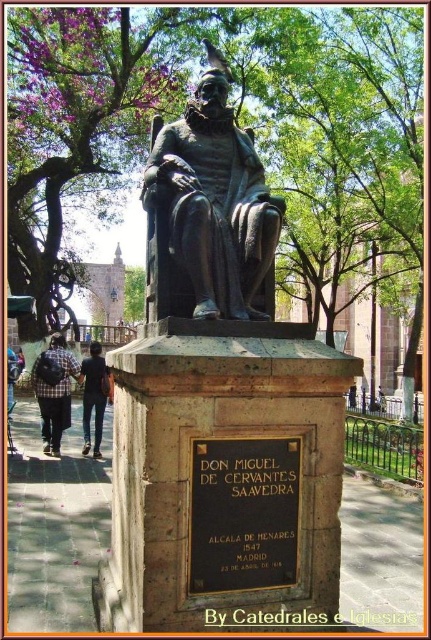
Question: Is black polished stone plaque at center below dark blue jeans at lower left?

Choices:
 (A) no
 (B) yes

Answer: (A)

Question: Can you confirm if black polished stone plaque at center is positioned to the right of dark blue jeans at lower left?

Choices:
 (A) yes
 (B) no

Answer: (A)

Question: Which of the following is the closest to the observer?

Choices:
 (A) plaid fabric backpack at lower left
 (B) dark blue jeans at lower left

Answer: (A)

Question: Which point is farther to the camera?

Choices:
 (A) bronze statue at center
 (B) dark blue jeans at lower left

Answer: (B)

Question: Which is farther from the dark blue jeans at lower left?

Choices:
 (A) plaid fabric backpack at lower left
 (B) black polished stone plaque at center
 (C) green leafy tree at upper center
 (D) bronze statue at center

Answer: (C)

Question: Is bronze statue at center in front of black polished stone plaque at center?

Choices:
 (A) yes
 (B) no

Answer: (B)